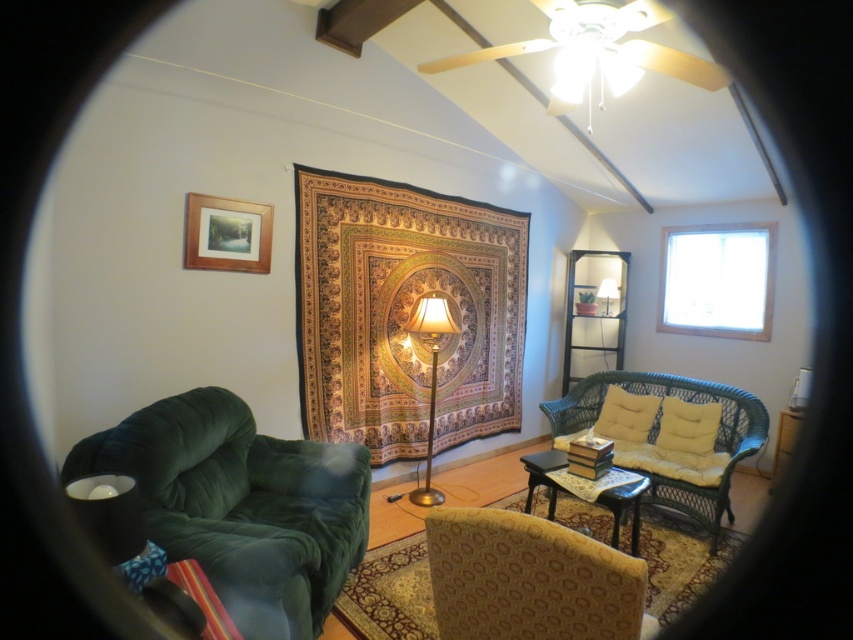
You are planning to place a large potted plant on the wooden table at center. Considering the size of the velvet green armchair at left, will the plant fit on the table?

The velvet green armchair at left is larger than the wooden table at center, so the plant may not fit comfortably on the wooden table at center due to its smaller size compared to the armchair.

You are an interior designer planning to place a new sofa that is 2 meters long in this living room. You want to position it so it faces both the wooden picture frame at upper left and the matte gold lamp at upper right. Is there enough space between these two objects to accommodate the sofa?

The wooden picture frame at upper left and matte gold lamp at upper right are 2.81 meters apart, which is more than the 2 meters length of the sofa. Therefore, there is enough space between them to place the sofa.